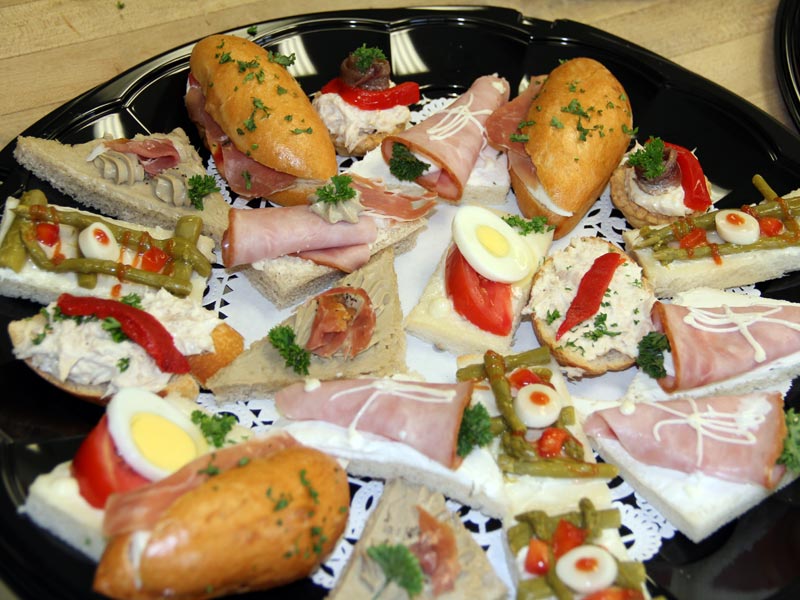
Find the location of a particular element. The width and height of the screenshot is (800, 600). doily is located at coordinates (642, 529).